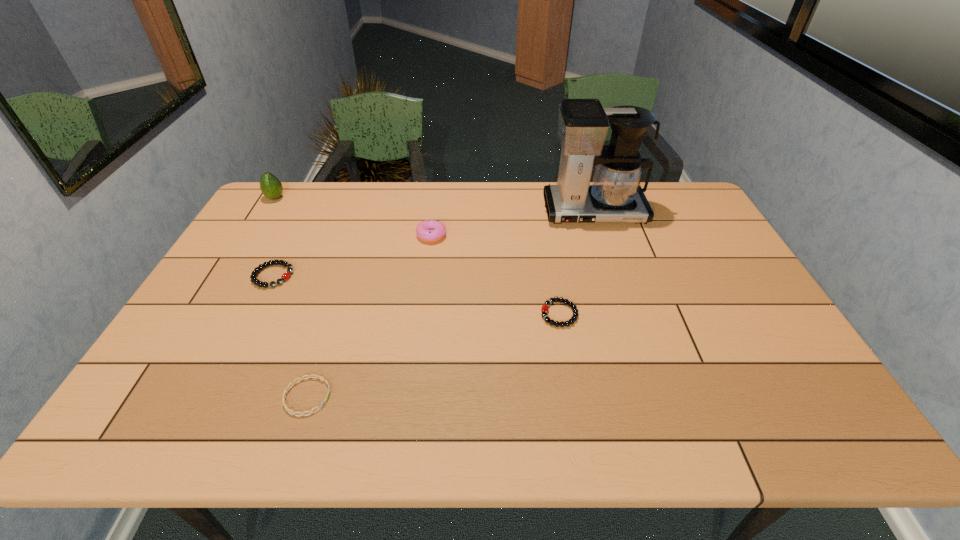
This screenshot has width=960, height=540. Find the location of `bracelet that stands as the third closest to the doughnut`. bracelet that stands as the third closest to the doughnut is located at coordinates (309, 376).

Identify the location of bracelet that can be found as the closest to the third tallest object. (286, 275).

This screenshot has width=960, height=540. I want to click on free location that satisfies the following two spatial constraints: 1. at the front of the tallest object where the controls are located; 2. on the surface of the fourth object from right to left showing star-shaped elements, so click(655, 396).